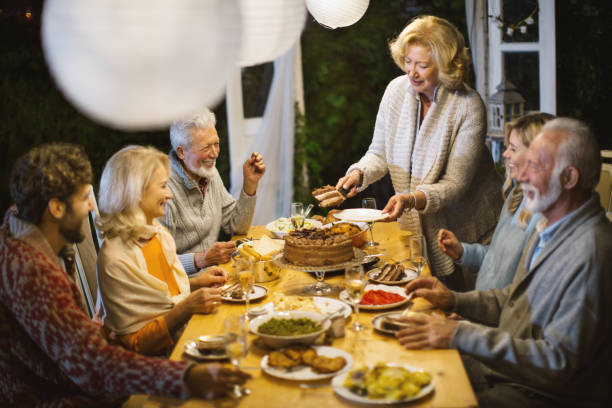
What are the coordinates of `plates` in the screenshot? It's located at (378, 386), (308, 362), (335, 294), (386, 297), (401, 268), (375, 212), (233, 294), (215, 353).